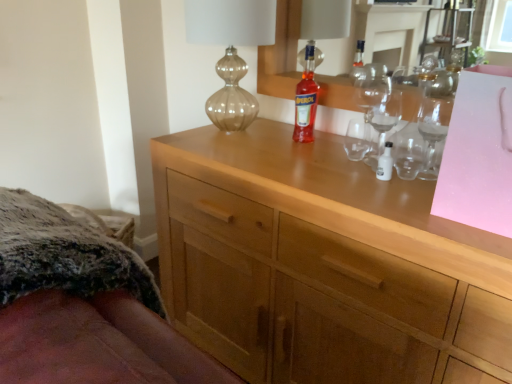
Identify the location of vacant area that lies between translucent glass vase at upper center and translucent glass bottle at center. The image size is (512, 384). (278, 146).